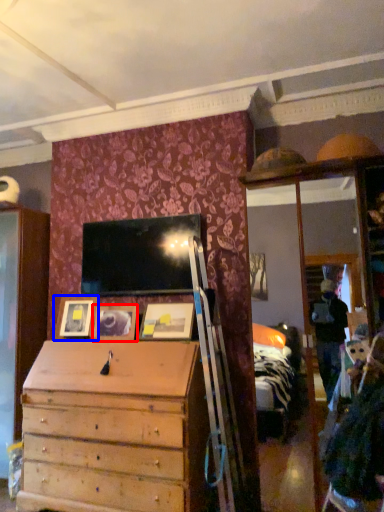
Question: Which of the following is the farthest to the observer, picture frame (highlighted by a red box) or picture frame (highlighted by a blue box)?

Choices:
 (A) picture frame
 (B) picture frame

Answer: (B)